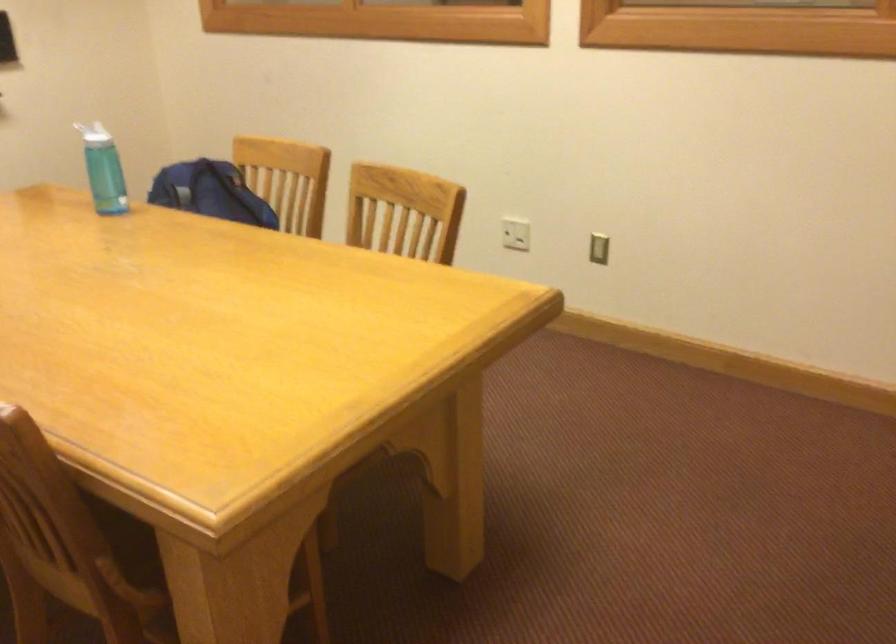
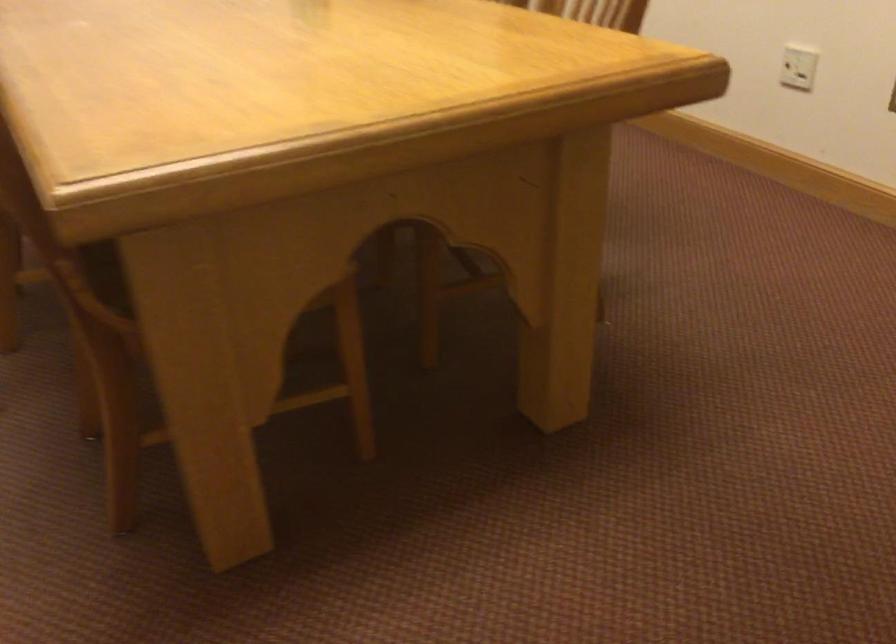
Which direction would the cameraman need to move to produce the second image?

The cameraman walked toward right, forward.